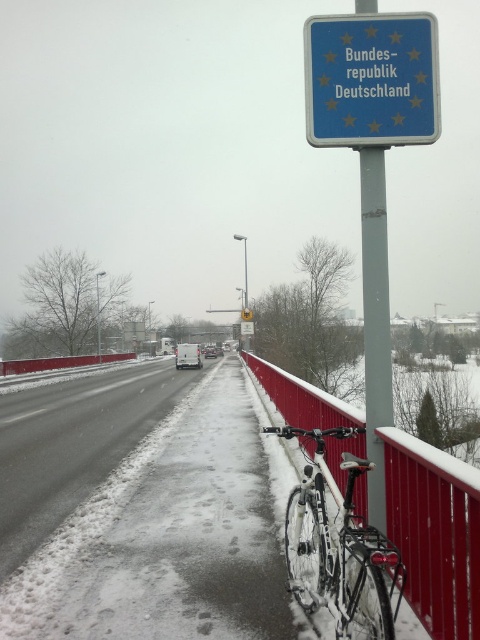
You are a delivery person on the bridge and need to deliver a package to the address indicated by the blue plastic sign at upper center. You have a cart that is 1.2 meters wide. Can your cart pass through the space between the shiny metallic bicycle at center and the red railing on the right?

The blue plastic sign at upper center is wider than the shiny metallic bicycle at center. However, the question is about the space between the bicycle and the railing. Since the Objects Description only compares their widths, not the available space, we cannot determine if the cart can pass. More information about the space width is needed.

You are a delivery person with a 1.8 meter wide cart. You need to pass between the red metal fence at right and the shiny metallic bicycle at center to reach the road on the left. Can your cart fit through the space between them?

The red metal fence at right and shiny metallic bicycle at center are 2.20 meters apart from each other. Since your cart is 1.8 meters wide, there is enough space for it to pass through the 2.20 meter gap between the two objects.

You are a delivery person who needs to reach the blue plastic sign at upper center from the shiny metallic bicycle at center. Given that your delivery cart can only move 7 feet before needing a recharge, will you be able to reach the sign without recharging?

The distance between the blue plastic sign at upper center and the shiny metallic bicycle at center is 8.01 feet. Since the delivery cart can only move 7 feet before needing a recharge, you will not be able to reach the sign without recharging.